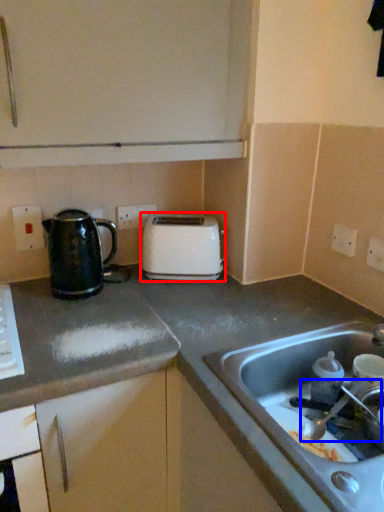
Question: Which of the following is the closest to the observer, toaster (highlighted by a red box) or faucet (highlighted by a blue box)?

Choices:
 (A) toaster
 (B) faucet

Answer: (B)